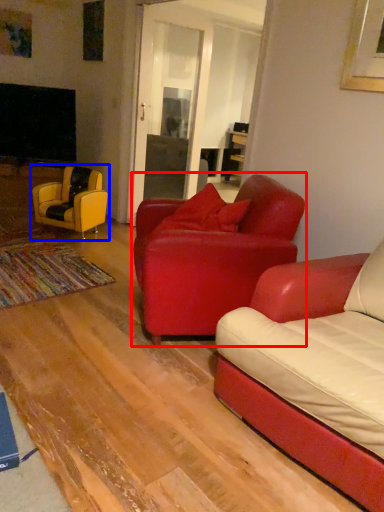
Question: Which object appears farthest to the camera in this image, chair (highlighted by a red box) or chair (highlighted by a blue box)?

Choices:
 (A) chair
 (B) chair

Answer: (B)